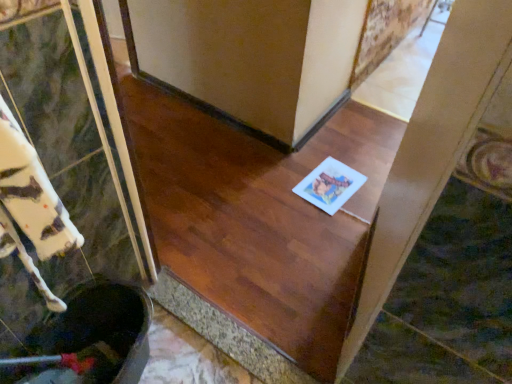
The image size is (512, 384). Identify the location of free space in front of white paper at center. (329, 221).